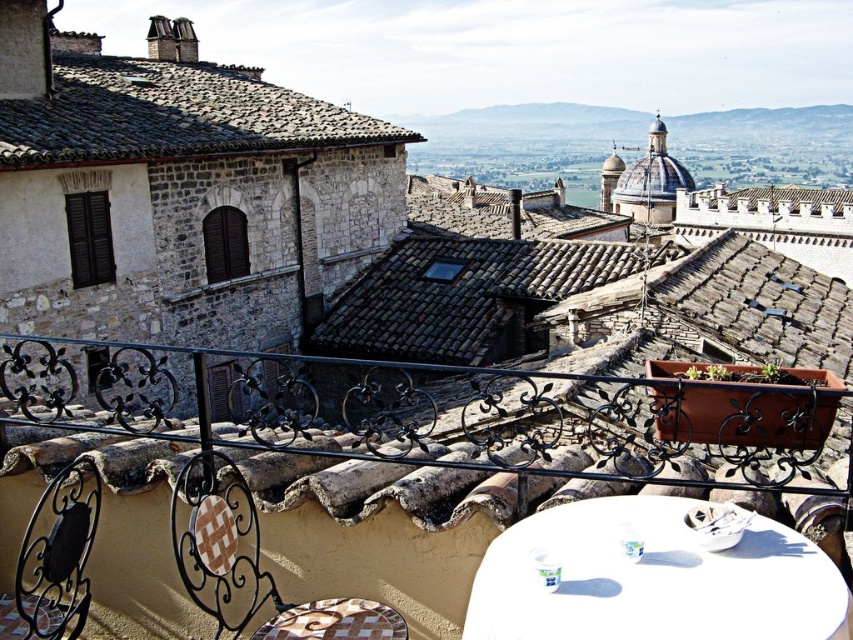
Question: Which object is closer to the camera taking this photo?

Choices:
 (A) black wrought iron railing at center
 (B) brown woven chair at lower left

Answer: (A)

Question: Among these points, which one is nearest to the camera?

Choices:
 (A) (672, 508)
 (B) (659, 410)
 (C) (213, 588)
 (D) (114, 112)

Answer: (A)

Question: Which object is positioned farthest from the white glossy table at lower right?

Choices:
 (A) brown woven chair at lower left
 (B) brown tiled roof at upper left
 (C) black wrought iron railing at center

Answer: (B)

Question: Does black wrought iron railing at center have a lesser width compared to brown woven chair at lower left?

Choices:
 (A) no
 (B) yes

Answer: (A)

Question: Is white glossy table at lower right thinner than brown tiled roof at upper left?

Choices:
 (A) no
 (B) yes

Answer: (B)

Question: Can you confirm if black wrought iron railing at center is positioned below brown woven chair at lower left?

Choices:
 (A) no
 (B) yes

Answer: (A)